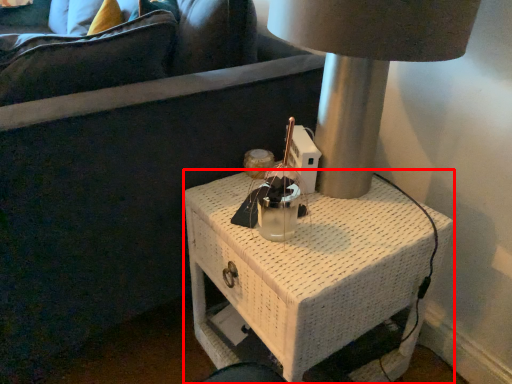
Question: Where is nightstand (annotated by the red box) located in relation to lamp in the image?

Choices:
 (A) left
 (B) right

Answer: (A)